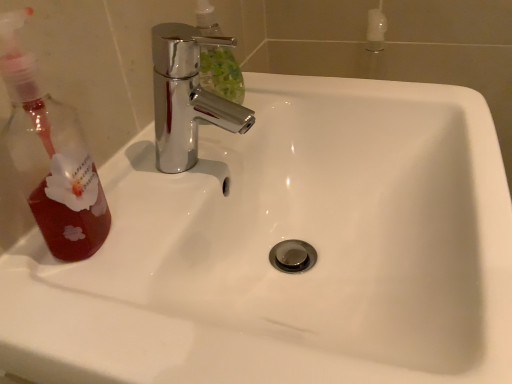
Question: From a real-world perspective, relative to chrome metallic faucet at upper center, is translucent red liquid at left vertically above or below?

Choices:
 (A) below
 (B) above

Answer: (B)

Question: Considering their positions, is translucent red liquid at left located in front of or behind chrome metallic faucet at upper center?

Choices:
 (A) front
 (B) behind

Answer: (A)

Question: Considering the positions of point (53, 223) and point (156, 163), is point (53, 223) closer or farther from the camera than point (156, 163)?

Choices:
 (A) farther
 (B) closer

Answer: (B)

Question: Considering the relative positions of chrome metallic faucet at upper center and translucent red liquid at left in the image provided, is chrome metallic faucet at upper center to the left or to the right of translucent red liquid at left?

Choices:
 (A) right
 (B) left

Answer: (A)

Question: Do you think chrome metallic faucet at upper center is within translucent red liquid at left, or outside of it?

Choices:
 (A) inside
 (B) outside

Answer: (B)

Question: Is chrome metallic faucet at upper center in front of or behind translucent red liquid at left in the image?

Choices:
 (A) behind
 (B) front

Answer: (A)

Question: From the image's perspective, relative to translucent red liquid at left, is chrome metallic faucet at upper center above or below?

Choices:
 (A) below
 (B) above

Answer: (B)